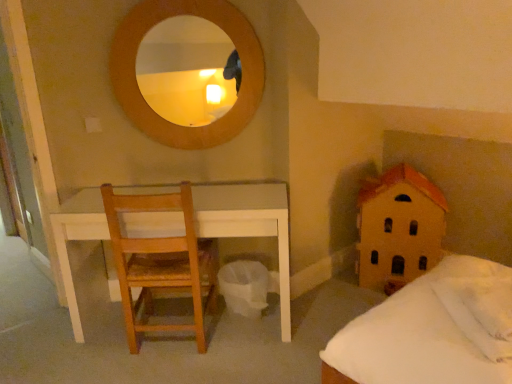
In order to click on vacant space positioned to the left of wooden house at right in this screenshot , I will do `click(335, 301)`.